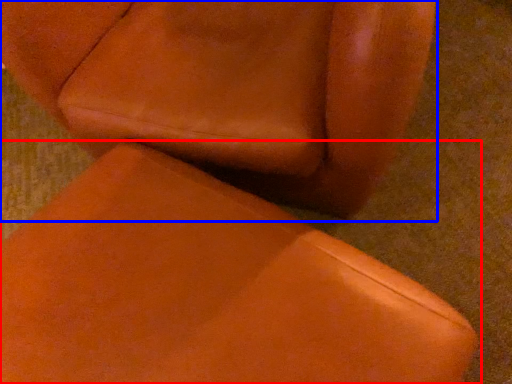
Question: Which of the following is the closest to the observer, chair (highlighted by a red box) or chair (highlighted by a blue box)?

Choices:
 (A) chair
 (B) chair

Answer: (A)